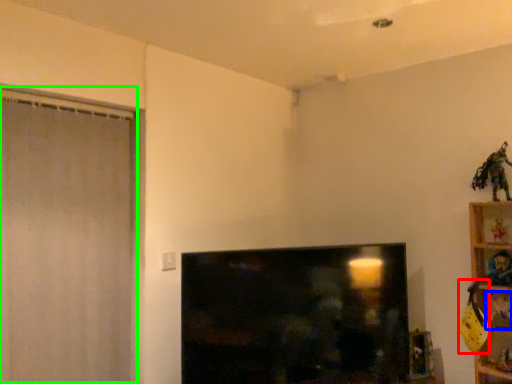
Question: Considering the real-world distances, which object is closest to toy (highlighted by a red box)? toy (highlighted by a blue box) or screen door (highlighted by a green box).

Choices:
 (A) toy
 (B) screen door

Answer: (A)